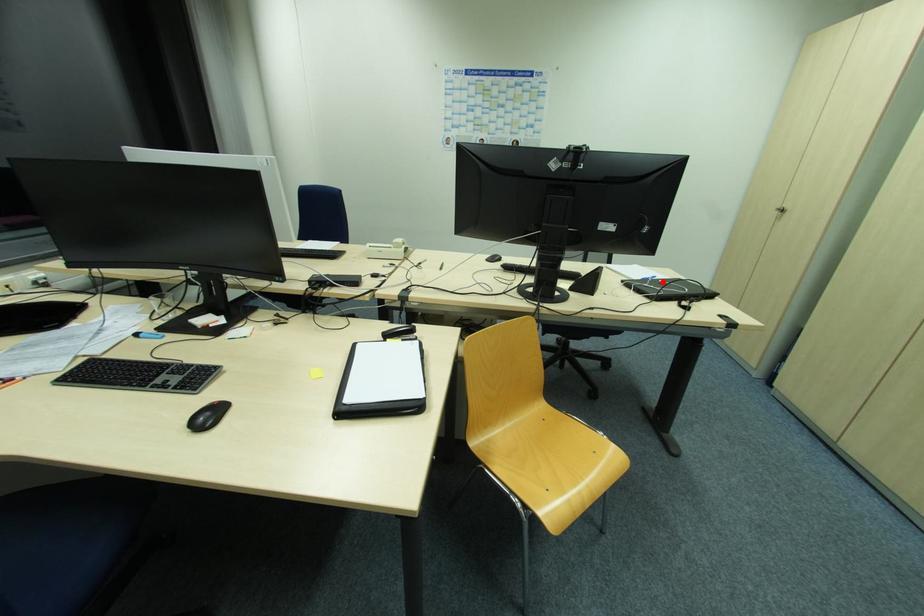
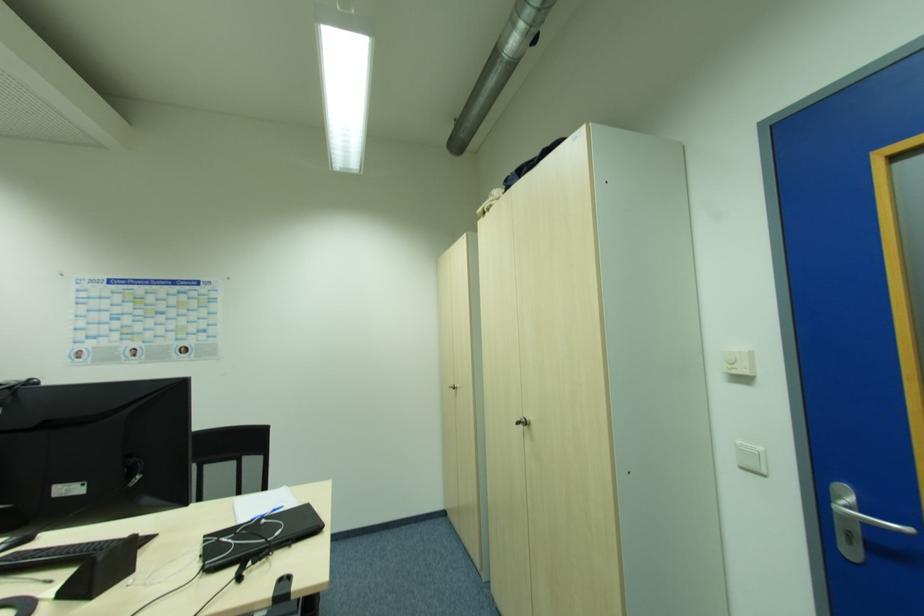
Where in the second image is the point corresponding to the highlighted location from the first image?

(265, 521)